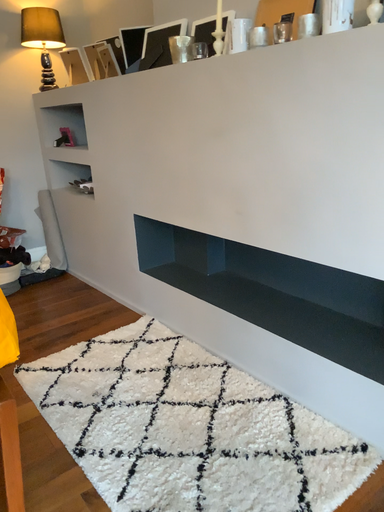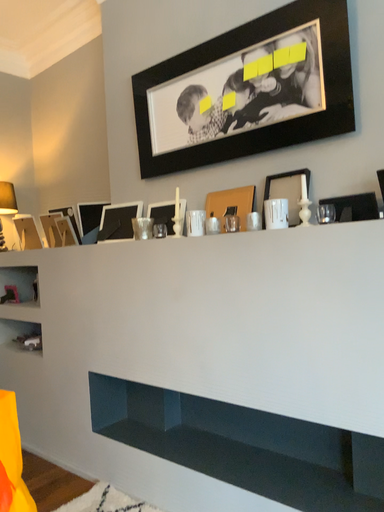
Question: How did the camera likely rotate when shooting the video?

Choices:
 (A) rotated right
 (B) rotated left

Answer: (A)